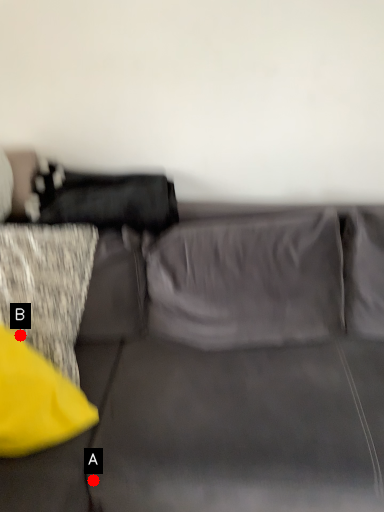
Question: Two points are circled on the image, labeled by A and B beside each circle. Which of the following is the closest to the observer?

Choices:
 (A) A is closer
 (B) B is closer

Answer: (A)